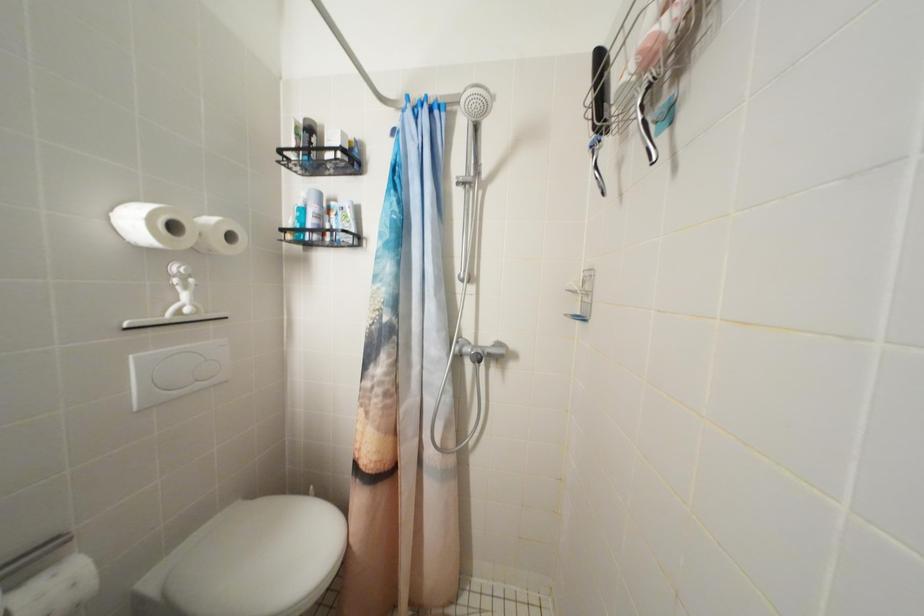
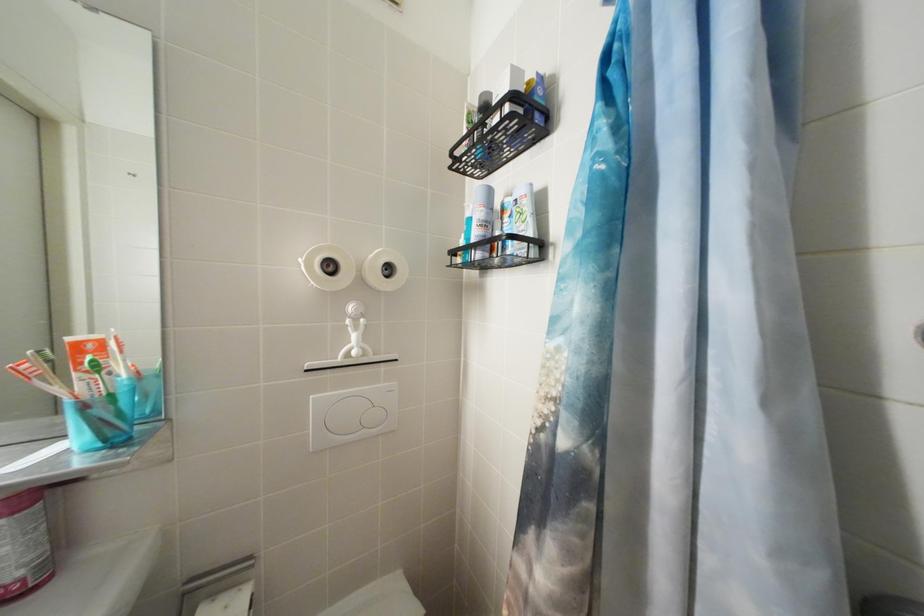
Question: The camera is either moving clockwise (left) or counter-clockwise (right) around the object. The first image is from the beginning of the video and the second image is from the end. Is the camera moving left or right when shooting the video?

Choices:
 (A) Left
 (B) Right

Answer: (B)